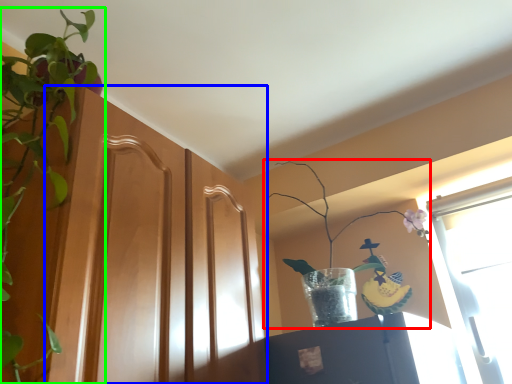
Question: Based on their relative distances, which object is nearer to houseplant (highlighted by a red box)? Choose from screen door (highlighted by a blue box) and houseplant (highlighted by a green box).

Choices:
 (A) screen door
 (B) houseplant

Answer: (A)